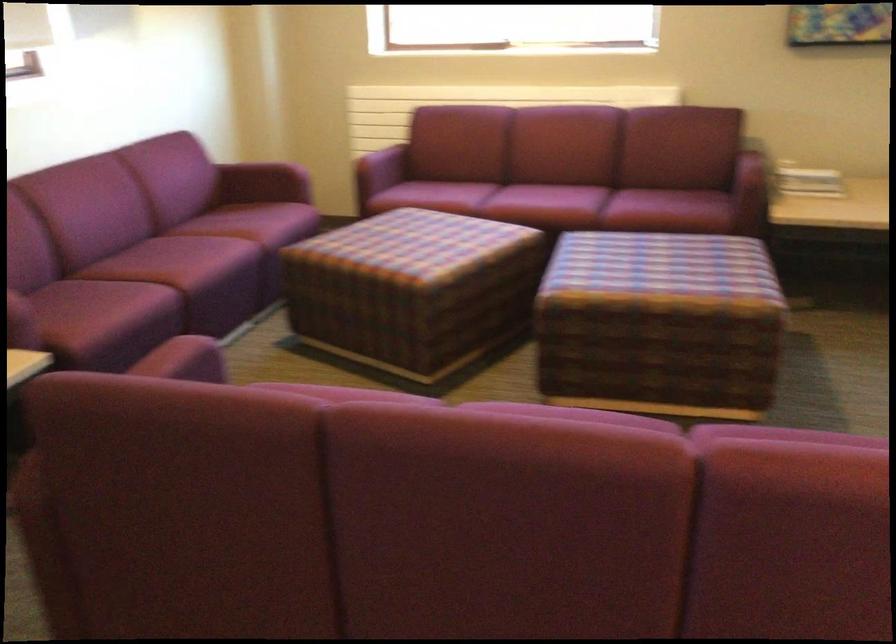
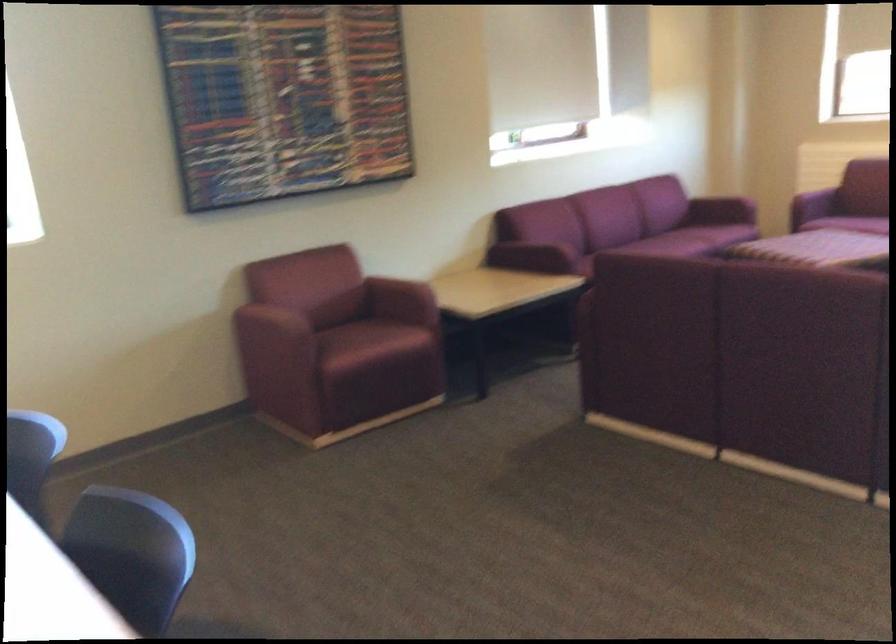
Locate, in the second image, the point that corresponds to point 216,243 in the first image.

(683, 242)